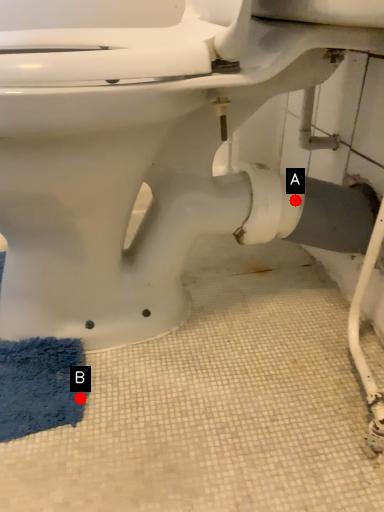
Question: Two points are circled on the image, labeled by A and B beside each circle. Which point is farther to the camera?

Choices:
 (A) A is further
 (B) B is further

Answer: (A)